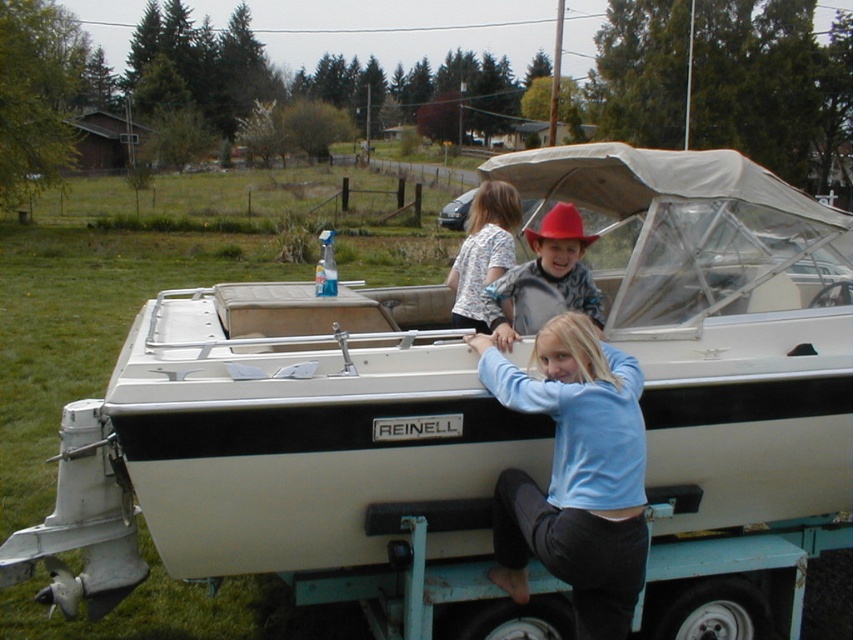
You are a photographer positioned at the origin point. The light blue sweater at center is at coordinates 0.742, 0.674. If you want to capture both the sweater and the spray bottle on the boat deck in the same frame, which direction should you move your camera?

The light blue sweater at center is located at point (x=573, y=474). To include both the sweater and the spray bottle on the boat deck in the frame, you should adjust your camera angle or move slightly towards the boat to ensure both objects are within the shot.

You are a photographer trying to capture the light blue sweater at center and the white cotton shirt at upper center in the same frame. Which clothing item should you focus on first to ensure both are in focus?

The light blue sweater at center is closer to the viewer than the white cotton shirt at upper center. To ensure both are in focus, you should focus on the light blue sweater at center first, as focusing on the closer object will help achieve depth of field that includes the farther one.